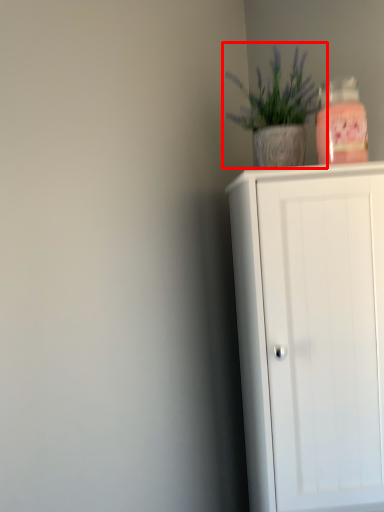
Question: From the image's perspective, considering the relative positions of houseplant (annotated by the red box) and cupboard in the image provided, where is houseplant (annotated by the red box) located with respect to the staircase?

Choices:
 (A) above
 (B) below

Answer: (A)